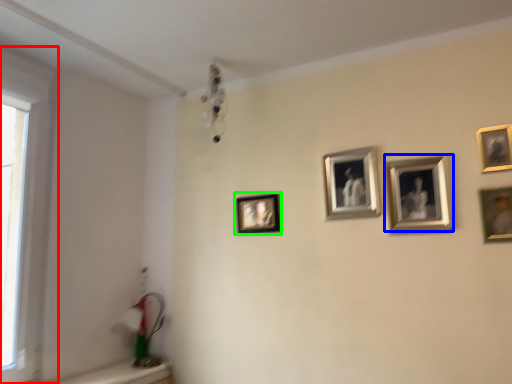
Question: Based on their relative distances, which object is farther from window (highlighted by a red box)? Choose from picture frame (highlighted by a blue box) and picture frame (highlighted by a green box).

Choices:
 (A) picture frame
 (B) picture frame

Answer: (A)